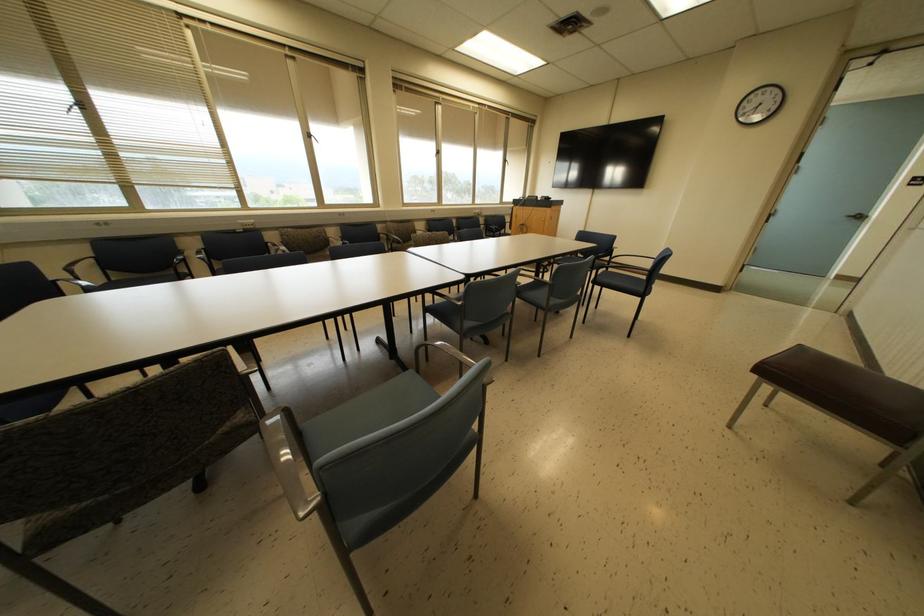
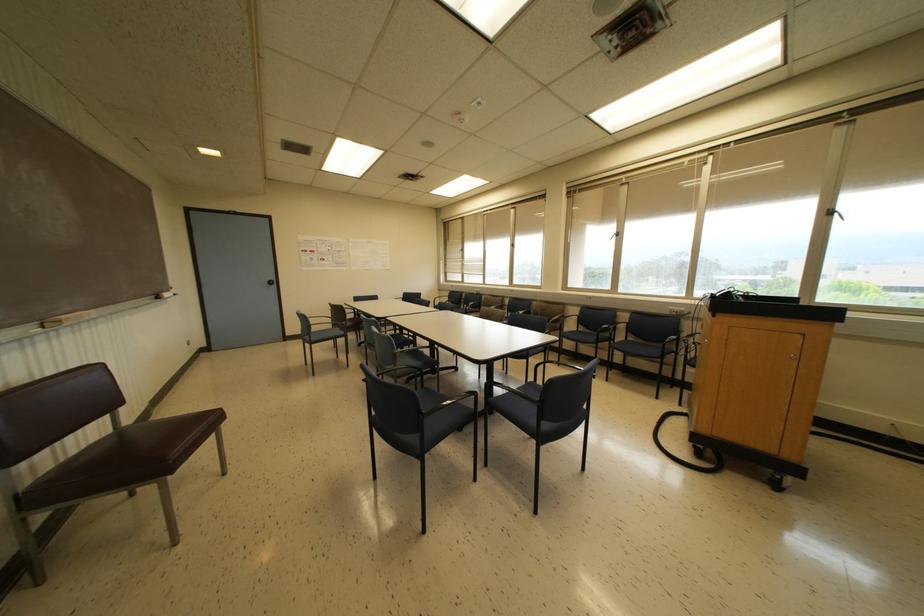
Find the pixel in the second image that matches point 438,152 in the first image.

(617, 233)